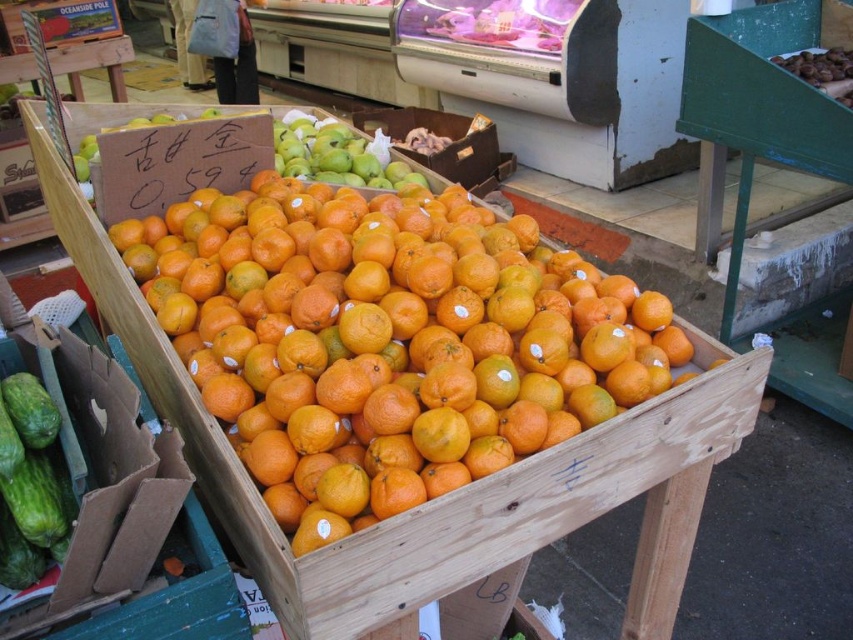
Question: Is orange matte at center smaller than green matte cucumber at lower left?

Choices:
 (A) yes
 (B) no

Answer: (B)

Question: Among these objects, which one is nearest to the camera?

Choices:
 (A) green matte apples at upper center
 (B) orange matte at center

Answer: (B)

Question: Can you confirm if orange matte at center is positioned above green matte apples at upper center?

Choices:
 (A) no
 (B) yes

Answer: (A)

Question: Which point is closer to the camera?

Choices:
 (A) orange matte at center
 (B) green matte cucumber at lower left
 (C) green matte apples at upper center

Answer: (B)

Question: Is orange matte at center wider than green matte apples at upper center?

Choices:
 (A) yes
 (B) no

Answer: (A)

Question: Based on their relative distances, which object is farther from the green matte cucumber at lower left?

Choices:
 (A) green matte apples at upper center
 (B) orange matte at center

Answer: (A)